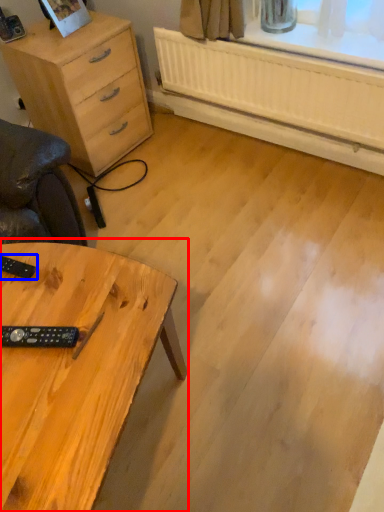
Question: Which object is further to the camera taking this photo, table (highlighted by a red box) or control (highlighted by a blue box)?

Choices:
 (A) table
 (B) control

Answer: (B)